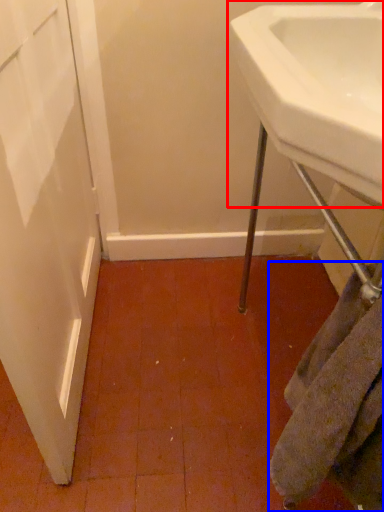
Question: Which object is further to the camera taking this photo, sink (highlighted by a red box) or towel/napkin (highlighted by a blue box)?

Choices:
 (A) sink
 (B) towel/napkin

Answer: (B)